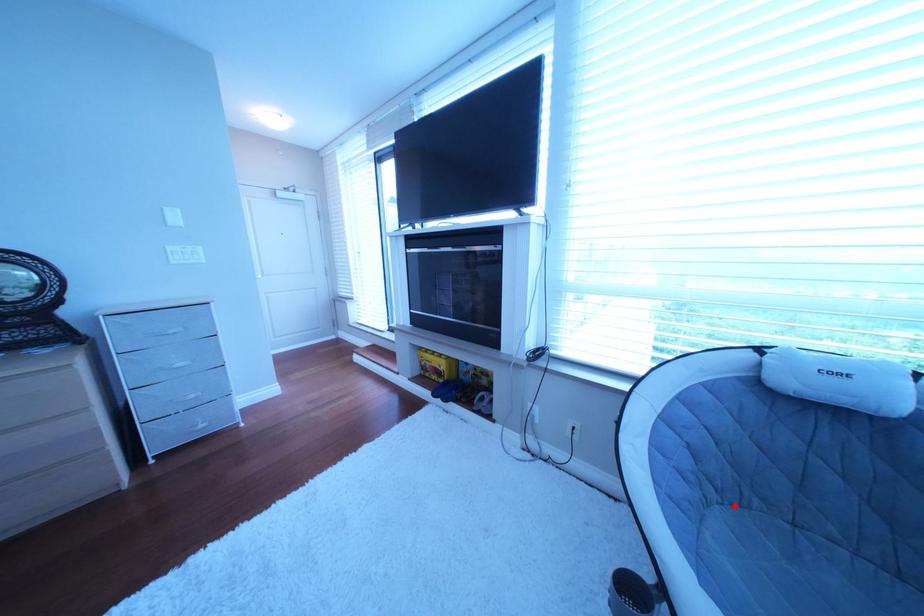
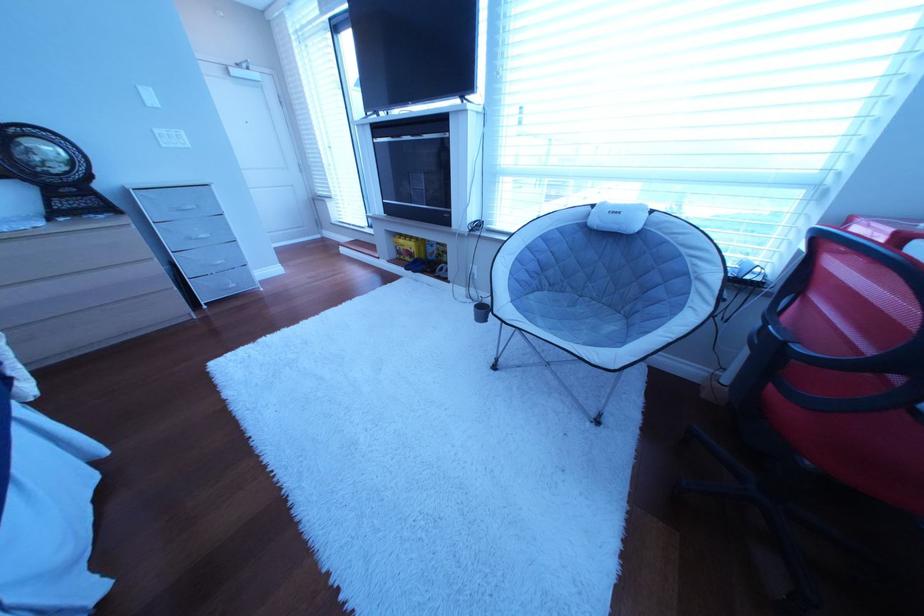
In the second image, find the point that corresponds to the highlighted location in the first image.

(565, 293)